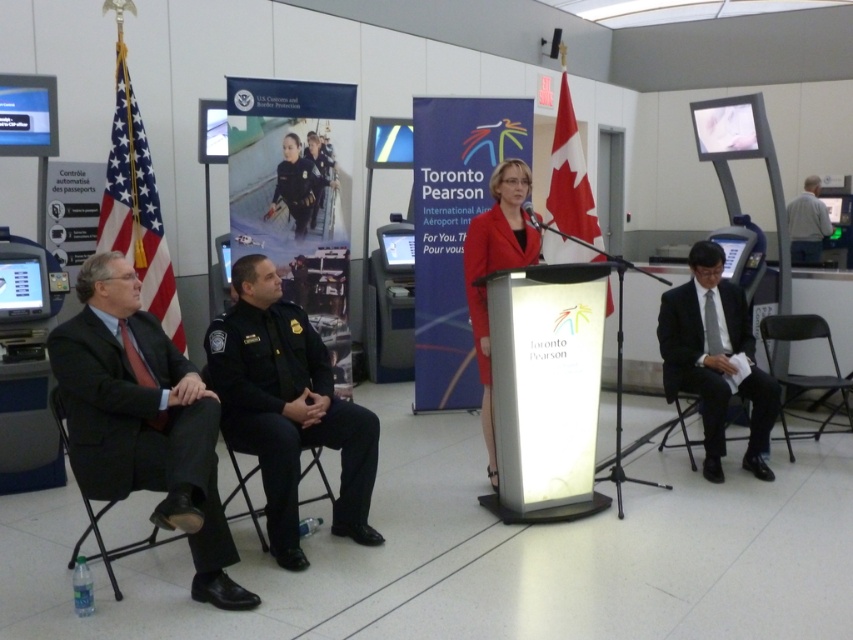
How far apart are dark suit at left and black plastic chair at lower right?

The distance of dark suit at left from black plastic chair at lower right is 3.70 meters.

Between dark suit at left and black plastic chair at lower right, which one appears on the left side from the viewer's perspective?

From the viewer's perspective, dark suit at left appears more on the left side.

Describe the element at coordinates (143, 420) in the screenshot. I see `dark suit at left` at that location.

I want to click on dark suit at left, so click(143, 420).

Identify the location of white shirt at right. This screenshot has height=640, width=853. (807, 224).

Where is `white shirt at right`? white shirt at right is located at coordinates (807, 224).

Which is above, black plastic chair at lower right or black fabric chair at center?

black plastic chair at lower right is above.

Which of these two, black plastic chair at lower right or black fabric chair at center, stands taller?

Standing taller between the two is black plastic chair at lower right.

This screenshot has height=640, width=853. Identify the location of black plastic chair at lower right. (804, 374).